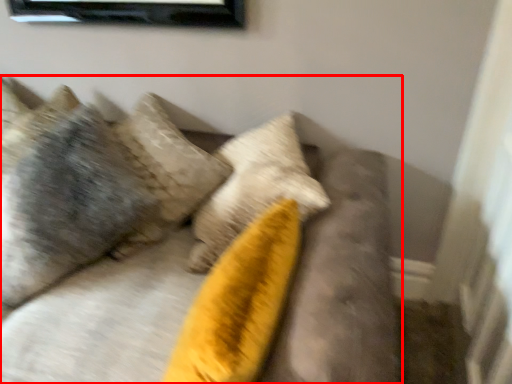
Question: From the image's perspective, where is furniture (annotated by the red box) located relative to pillow?

Choices:
 (A) below
 (B) above

Answer: (A)